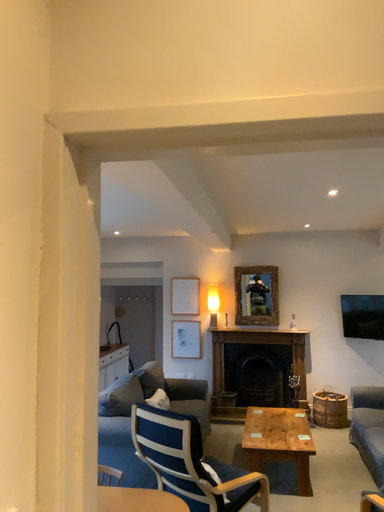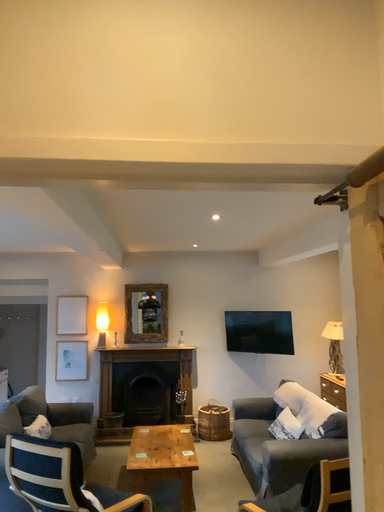
Question: How did the camera likely rotate when shooting the video?

Choices:
 (A) rotated left
 (B) rotated right

Answer: (B)